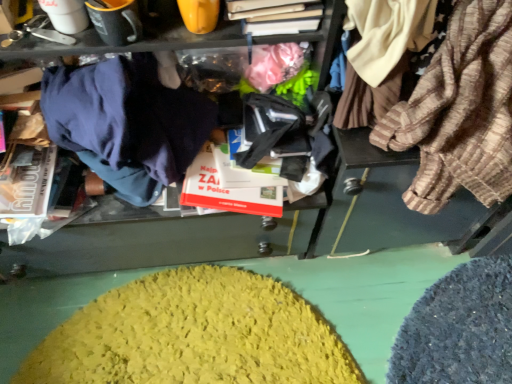
This screenshot has width=512, height=384. What do you see at coordinates (127, 123) in the screenshot?
I see `dark blue fabric at left, the second clothing positioned from the right` at bounding box center [127, 123].

Describe the element at coordinates (460, 112) in the screenshot. I see `striped cotton shirt at right, which appears as the second clothing when viewed from the left` at that location.

You are a GUI agent. You are given a task and a screenshot of the screen. Output one action in this format:
    pyautogui.click(x=<x>, y=<y>)
    Task: Click on the yellow fuzzy rug at lower center
    This screenshot has height=384, width=512.
    Given the screenshot: What is the action you would take?
    pyautogui.click(x=194, y=334)

From the image's perspective, is dark blue fabric at left, the second clothing positioned from the right, located above or below yellow fuzzy rug at lower center?

From the image's perspective, dark blue fabric at left, the second clothing positioned from the right, appears above yellow fuzzy rug at lower center.

Does dark blue fabric at left, the second clothing positioned from the right, appear on the left side of yellow fuzzy rug at lower center?

Yes.

How many degrees apart are the facing directions of dark blue fabric at left, the second clothing positioned from the right, and yellow fuzzy rug at lower center?

93.6 degrees separate the facing orientations of dark blue fabric at left, the second clothing positioned from the right, and yellow fuzzy rug at lower center.

Between point (78, 84) and point (137, 319), which one is positioned behind?

The point (137, 319) is behind.

How different are the orientations of matte white coffee cup at upper left and dark blue fabric at left, the second clothing positioned from the right, in degrees?

matte white coffee cup at upper left and dark blue fabric at left, the second clothing positioned from the right, are facing 0.000161 degrees away from each other.

From a real-world perspective, which is physically above, matte white coffee cup at upper left or dark blue fabric at left, the first clothing viewed from the left?

matte white coffee cup at upper left.

Is matte white coffee cup at upper left spatially inside dark blue fabric at left, the first clothing viewed from the left, or outside of it?

matte white coffee cup at upper left cannot be found inside dark blue fabric at left, the first clothing viewed from the left.

Can you confirm if matte white coffee cup at upper left is smaller than dark blue fabric at left, the first clothing viewed from the left?

Indeed, matte white coffee cup at upper left has a smaller size compared to dark blue fabric at left, the first clothing viewed from the left.

Where is `the 2nd clothing in front of the matte white coffee cup at upper left, starting your count from the anchor`? The height and width of the screenshot is (384, 512). the 2nd clothing in front of the matte white coffee cup at upper left, starting your count from the anchor is located at coordinates (460, 112).

Does matte white coffee cup at upper left have a lesser width compared to striped cotton shirt at right, the 1th clothing when ordered from right to left?

Correct, the width of matte white coffee cup at upper left is less than that of striped cotton shirt at right, the 1th clothing when ordered from right to left.

How far apart are dark blue fabric at left, the second clothing positioned from the right, and striped cotton shirt at right, which appears as the second clothing when viewed from the left?

dark blue fabric at left, the second clothing positioned from the right, is 19.74 inches from striped cotton shirt at right, which appears as the second clothing when viewed from the left.

Is dark blue fabric at left, the second clothing positioned from the right, oriented towards striped cotton shirt at right, the 1th clothing when ordered from right to left?

No, dark blue fabric at left, the second clothing positioned from the right, is not turned towards striped cotton shirt at right, the 1th clothing when ordered from right to left.

From a real-world perspective, is dark blue fabric at left, the first clothing viewed from the left, below striped cotton shirt at right, which appears as the second clothing when viewed from the left?

Yes, from a real-world perspective, dark blue fabric at left, the first clothing viewed from the left, is beneath striped cotton shirt at right, which appears as the second clothing when viewed from the left.

Which is behind, point (210, 371) or point (80, 30)?

The point (210, 371) is farther from the camera.

Considering the positions of objects yellow fuzzy rug at lower center and matte white coffee cup at upper left in the image provided, who is in front, yellow fuzzy rug at lower center or matte white coffee cup at upper left?

Positioned in front is matte white coffee cup at upper left.

Does yellow fuzzy rug at lower center turn towards matte white coffee cup at upper left?

No, yellow fuzzy rug at lower center is not aimed at matte white coffee cup at upper left.

From the picture: Can you confirm if yellow fuzzy rug at lower center is shorter than matte white coffee cup at upper left?

Yes, yellow fuzzy rug at lower center is shorter than matte white coffee cup at upper left.

From a real-world perspective, which object rests below the other?

yellow fuzzy rug at lower center is physically lower.

Is point (207, 342) positioned before point (130, 100)?

That is False.

Can you tell me how much yellow fuzzy rug at lower center and dark blue fabric at left, the first clothing viewed from the left, differ in facing direction?

The facing directions of yellow fuzzy rug at lower center and dark blue fabric at left, the first clothing viewed from the left, are 93.6 degrees apart.

Is dark blue fabric at left, the second clothing positioned from the right, inside yellow fuzzy rug at lower center?

No, dark blue fabric at left, the second clothing positioned from the right, is not a part of yellow fuzzy rug at lower center.

Does point (183, 122) come behind point (74, 25)?

Yes.

Is dark blue fabric at left, the second clothing positioned from the right, wider than matte white coffee cup at upper left?

Yes.

Is dark blue fabric at left, the first clothing viewed from the left, located outside matte white coffee cup at upper left?

Absolutely, dark blue fabric at left, the first clothing viewed from the left, is external to matte white coffee cup at upper left.

Which object is positioned more to the right, dark blue fabric at left, the first clothing viewed from the left, or matte white coffee cup at upper left?

dark blue fabric at left, the first clothing viewed from the left, is more to the right.

Find the location of a particular element. The height and width of the screenshot is (384, 512). debris below the dark blue fabric at left, the second clothing positioned from the right (from a real-world perspective) is located at coordinates (194, 334).

You are a GUI agent. You are given a task and a screenshot of the screen. Output one action in this format:
    pyautogui.click(x=<x>, y=<y>)
    Task: Click on the coffee cup that is behind the dark blue fabric at left, the second clothing positioned from the right
    This screenshot has width=512, height=384.
    Given the screenshot: What is the action you would take?
    pyautogui.click(x=66, y=15)

When comparing their distances from yellow fuzzy rug at lower center, does dark blue fabric at left, the first clothing viewed from the left, or striped cotton shirt at right, the 1th clothing when ordered from right to left, seem further?

striped cotton shirt at right, the 1th clothing when ordered from right to left, is positioned further to the anchor yellow fuzzy rug at lower center.

Based on their spatial positions, is yellow fuzzy rug at lower center or striped cotton shirt at right, the 1th clothing when ordered from right to left, closer to matte white coffee cup at upper left?

striped cotton shirt at right, the 1th clothing when ordered from right to left, lies closer to matte white coffee cup at upper left than the other object.

Looking at the image, which one is located further to matte white coffee cup at upper left, dark blue fabric at left, the second clothing positioned from the right, or striped cotton shirt at right, the 1th clothing when ordered from right to left?

striped cotton shirt at right, the 1th clothing when ordered from right to left, is further to matte white coffee cup at upper left.

Estimate the real-world distances between objects in this image. Which object is closer to dark blue fabric at left, the second clothing positioned from the right, yellow fuzzy rug at lower center or striped cotton shirt at right, the 1th clothing when ordered from right to left?

The object closer to dark blue fabric at left, the second clothing positioned from the right, is striped cotton shirt at right, the 1th clothing when ordered from right to left.

Looking at the image, which one is located further to yellow fuzzy rug at lower center, striped cotton shirt at right, the 1th clothing when ordered from right to left, or dark blue fabric at left, the second clothing positioned from the right?

striped cotton shirt at right, the 1th clothing when ordered from right to left, is further to yellow fuzzy rug at lower center.

Which object lies further to the anchor point matte white coffee cup at upper left, striped cotton shirt at right, the 1th clothing when ordered from right to left, or yellow fuzzy rug at lower center?

yellow fuzzy rug at lower center is positioned further to the anchor matte white coffee cup at upper left.

Considering their positions, is yellow fuzzy rug at lower center positioned further to striped cotton shirt at right, the 1th clothing when ordered from right to left, than matte white coffee cup at upper left?

Among the two, matte white coffee cup at upper left is located further to striped cotton shirt at right, the 1th clothing when ordered from right to left.

Looking at the image, which one is located closer to striped cotton shirt at right, the 1th clothing when ordered from right to left, dark blue fabric at left, the second clothing positioned from the right, or yellow fuzzy rug at lower center?

The object closer to striped cotton shirt at right, the 1th clothing when ordered from right to left, is dark blue fabric at left, the second clothing positioned from the right.

The width and height of the screenshot is (512, 384). I want to click on debris between dark blue fabric at left, the first clothing viewed from the left, and striped cotton shirt at right, the 1th clothing when ordered from right to left, from left to right, so click(x=194, y=334).

I want to click on clothing between matte white coffee cup at upper left and striped cotton shirt at right, the 1th clothing when ordered from right to left, from left to right, so click(x=127, y=123).